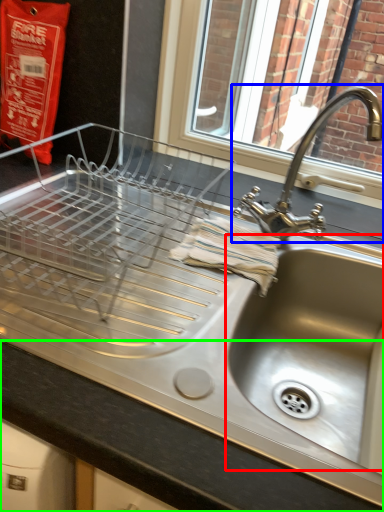
Question: Which object is positioned closest to sink (highlighted by a red box)? Select from tap (highlighted by a blue box) and counter top (highlighted by a green box).

Choices:
 (A) tap
 (B) counter top

Answer: (A)